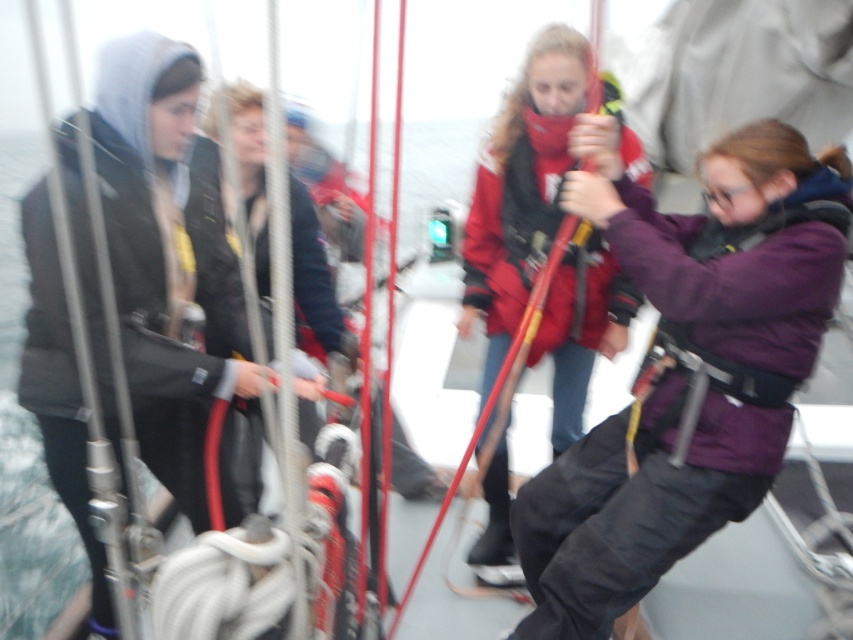
Question: Which point is farther to the camera?

Choices:
 (A) purple fleece jacket at center
 (B) matte black jacket at left

Answer: (A)

Question: Can you confirm if purple fleece jacket at center is positioned above matte black jacket at left?

Choices:
 (A) no
 (B) yes

Answer: (A)

Question: Does purple fleece jacket at center have a larger size compared to matte black jacket at left?

Choices:
 (A) yes
 (B) no

Answer: (B)

Question: Is purple fleece jacket at center to the left of matte black jacket at left from the viewer's perspective?

Choices:
 (A) no
 (B) yes

Answer: (A)

Question: Which point appears closest to the camera in this image?

Choices:
 (A) (741, 397)
 (B) (154, 326)

Answer: (A)

Question: Which point is farther to the camera?

Choices:
 (A) (762, 160)
 (B) (42, 371)

Answer: (B)